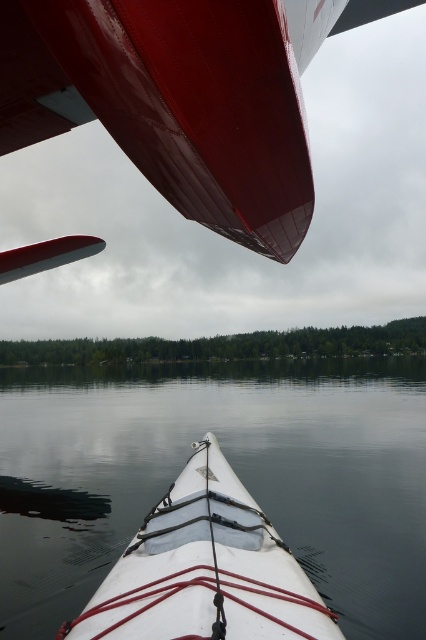
Does glossy red airplane wing at upper left have a lesser width compared to white matte kayak at center?

Correct, glossy red airplane wing at upper left's width is less than white matte kayak at center's.

The height and width of the screenshot is (640, 426). Find the location of `glossy red airplane wing at upper left`. glossy red airplane wing at upper left is located at coordinates 167,102.

Who is more forward, (86, 61) or (166, 573)?

Point (86, 61)

Where is `glossy red airplane wing at upper left`? glossy red airplane wing at upper left is located at coordinates (167, 102).